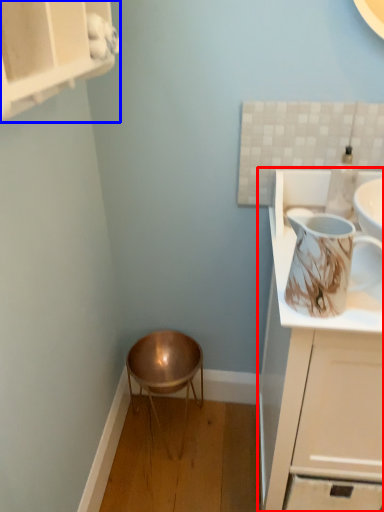
Question: Among these objects, which one is nearest to the camera, cabinetry (highlighted by a red box) or cabinetry (highlighted by a blue box)?

Choices:
 (A) cabinetry
 (B) cabinetry

Answer: (B)